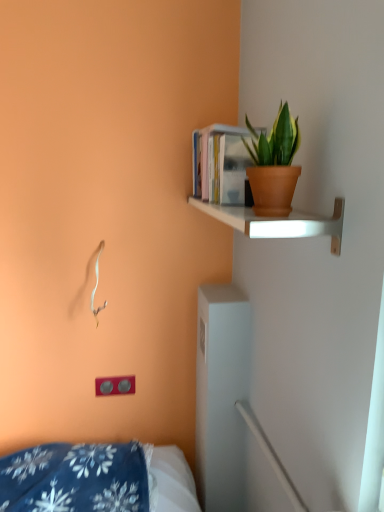
Question: Is matte gray electric outlet at lower left positioned with its back to terracotta pot at upper right?

Choices:
 (A) yes
 (B) no

Answer: (B)

Question: Are matte gray electric outlet at lower left and terracotta pot at upper right far apart?

Choices:
 (A) no
 (B) yes

Answer: (B)

Question: From the image's perspective, does matte gray electric outlet at lower left appear higher than terracotta pot at upper right?

Choices:
 (A) no
 (B) yes

Answer: (A)

Question: From the image's perspective, would you say matte gray electric outlet at lower left is shown under terracotta pot at upper right?

Choices:
 (A) yes
 (B) no

Answer: (A)

Question: Does matte gray electric outlet at lower left have a smaller size compared to terracotta pot at upper right?

Choices:
 (A) no
 (B) yes

Answer: (B)

Question: Considering the relative sizes of matte gray electric outlet at lower left and terracotta pot at upper right in the image provided, is matte gray electric outlet at lower left shorter than terracotta pot at upper right?

Choices:
 (A) no
 (B) yes

Answer: (B)

Question: Can you confirm if hardcover books at upper right is smaller than matte gray electric outlet at lower left?

Choices:
 (A) yes
 (B) no

Answer: (B)

Question: From a real-world perspective, is hardcover books at upper right physically below matte gray electric outlet at lower left?

Choices:
 (A) yes
 (B) no

Answer: (B)

Question: Is hardcover books at upper right surrounding matte gray electric outlet at lower left?

Choices:
 (A) yes
 (B) no

Answer: (B)

Question: Is hardcover books at upper right positioned in front of matte gray electric outlet at lower left?

Choices:
 (A) no
 (B) yes

Answer: (B)

Question: Is hardcover books at upper right to the right of matte gray electric outlet at lower left from the viewer's perspective?

Choices:
 (A) yes
 (B) no

Answer: (A)

Question: Does hardcover books at upper right have a lesser height compared to matte gray electric outlet at lower left?

Choices:
 (A) no
 (B) yes

Answer: (A)

Question: Does matte white shelf at upper right appear on the left side of hardcover books at upper right?

Choices:
 (A) no
 (B) yes

Answer: (A)